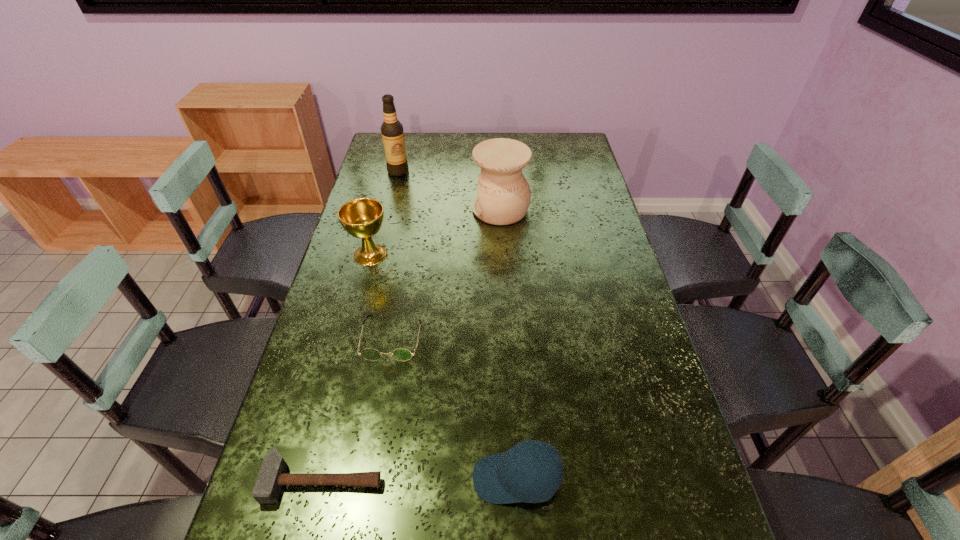
Identify the location of free space between the tallest object and the fifth shortest object. The image size is (960, 540). click(x=449, y=190).

At what (x,y) coordinates should I click in order to perform the action: click on free spot between the tallest object and the fifth tallest object. Please return your answer as a coordinate pair (x, y). The image size is (960, 540). Looking at the image, I should click on (396, 254).

Where is `vacant space that's between the alcohol and the chalice`? Image resolution: width=960 pixels, height=540 pixels. vacant space that's between the alcohol and the chalice is located at coordinates (384, 213).

At what (x,y) coordinates should I click in order to perform the action: click on free area in between the shortest object and the fourth nearest object. Please return your answer as a coordinate pair (x, y). Image resolution: width=960 pixels, height=540 pixels. Looking at the image, I should click on (347, 367).

Where is `object that can be found as the fourth closest to the third shortest object`? object that can be found as the fourth closest to the third shortest object is located at coordinates (504, 195).

Identify the location of object that ranks as the second closest to the third tallest object. (504, 195).